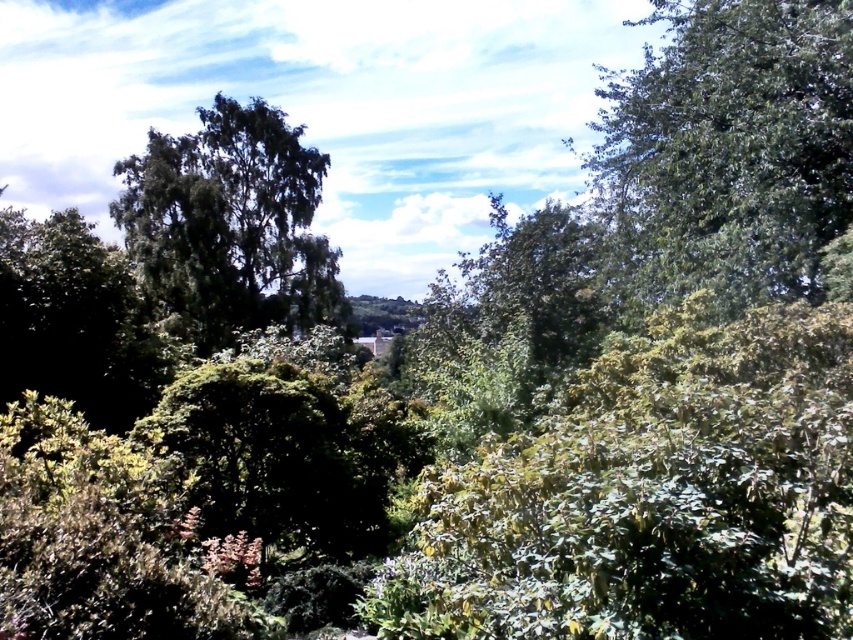
Does green leafy tree at upper right have a larger size compared to green leafy tree at left?

Incorrect, green leafy tree at upper right is not larger than green leafy tree at left.

Is green leafy tree at upper right to the right of green leafy tree at left from the viewer's perspective?

Indeed, green leafy tree at upper right is positioned on the right side of green leafy tree at left.

Is point (693, 96) less distant than point (259, 116)?

Yes, point (693, 96) is in front of point (259, 116).

The width and height of the screenshot is (853, 640). What are the coordinates of `green leafy tree at upper right` in the screenshot? It's located at (726, 152).